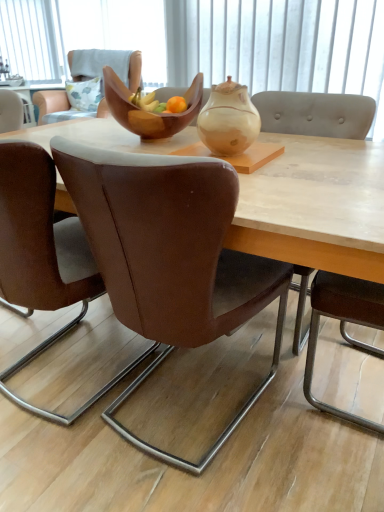
Locate an element on the screen. This screenshot has height=512, width=384. free point above wooden bowl at center (from a real-world perspective) is located at coordinates (278, 157).